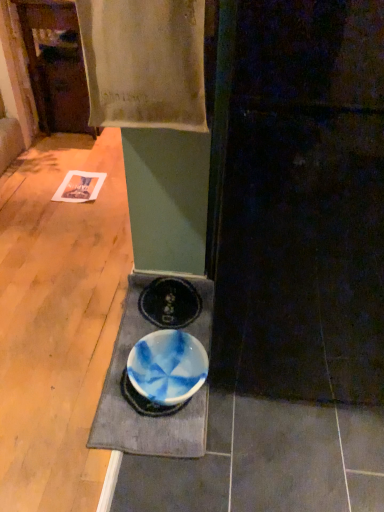
At what (x,y) coordinates should I click in order to perform the action: click on vacant region to the left of blue glazed bowl at lower center. Please return your answer as a coordinate pair (x, y). Looking at the image, I should click on (74, 379).